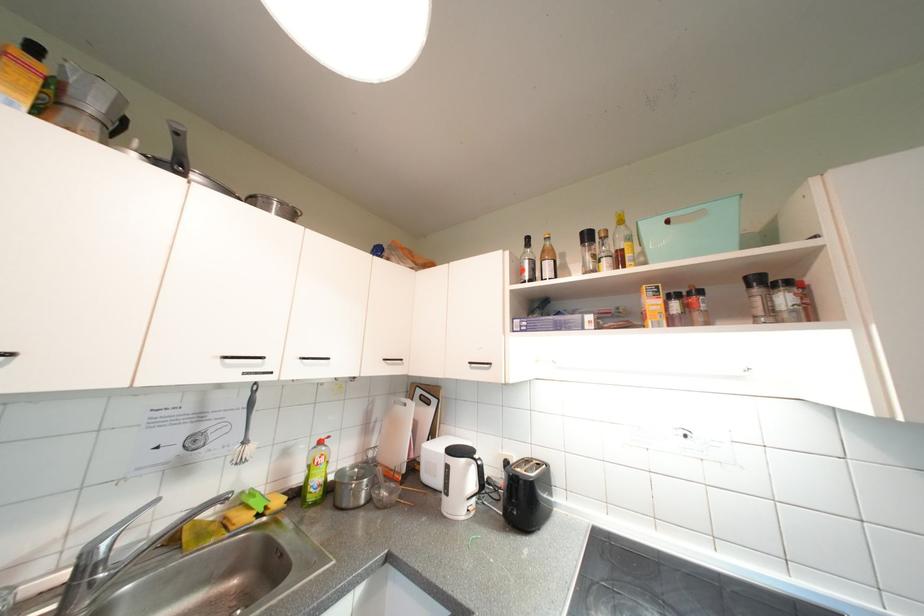
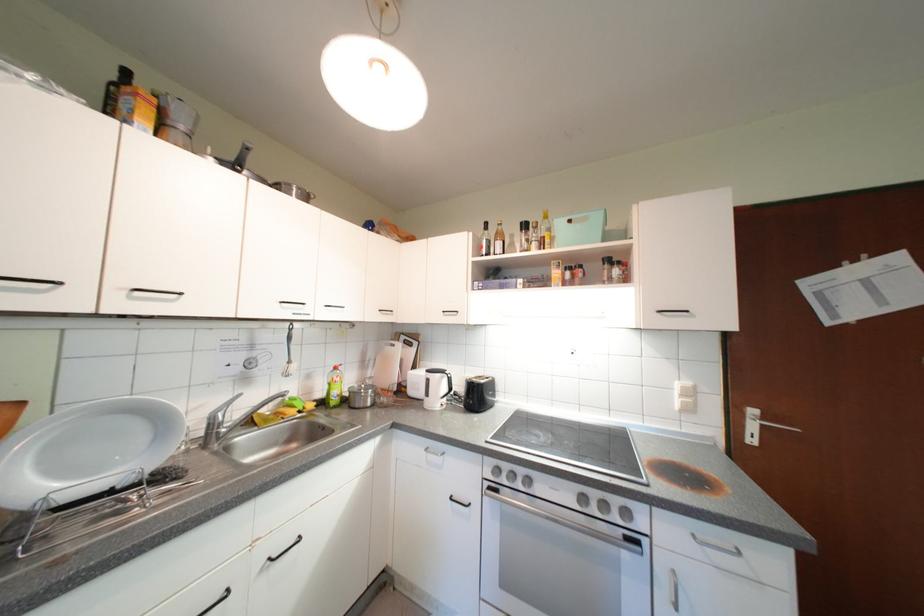
In the second image, find the point that corresponds to the point at 94,556 in the first image.

(220, 419)